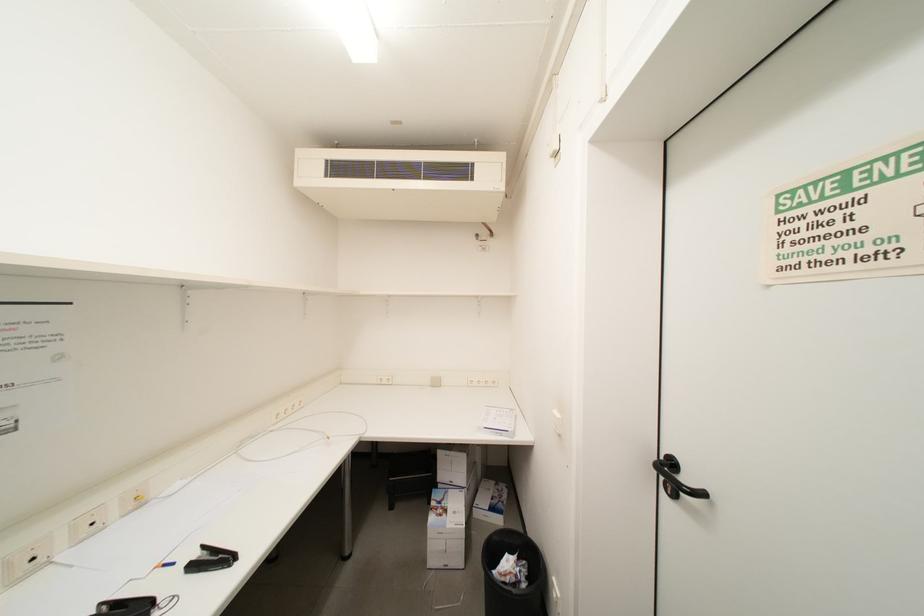
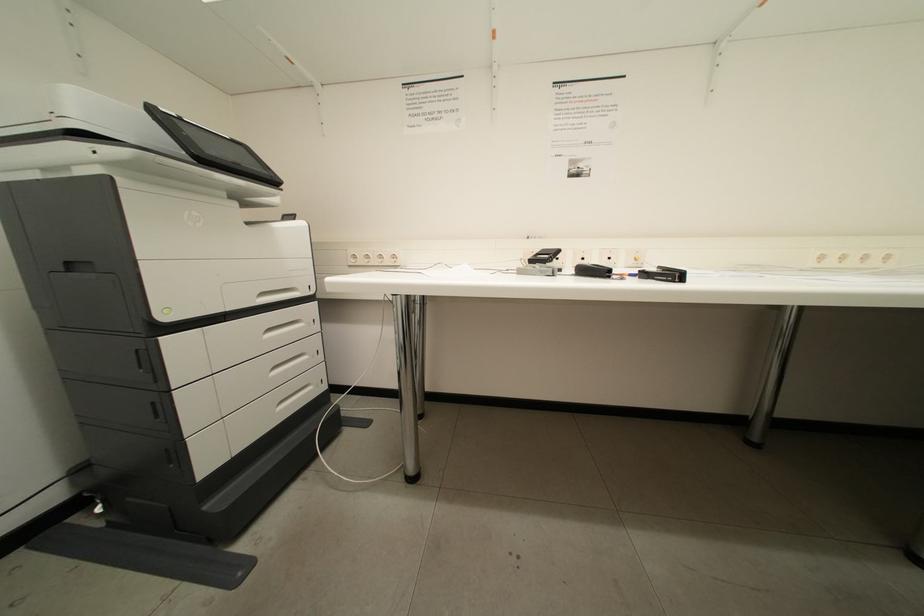
Question: How did the camera likely rotate?

Choices:
 (A) Left
 (B) Right
 (C) Up
 (D) Down

Answer: (A)